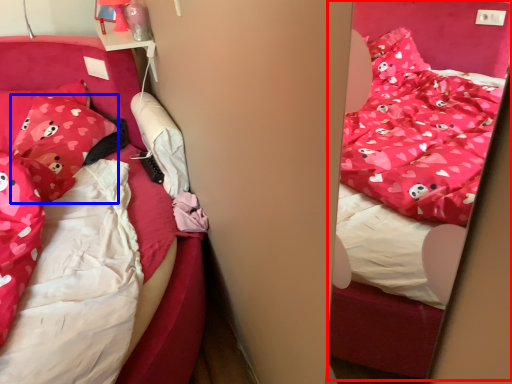
Question: Which object is further to the camera taking this photo, bed (highlighted by a red box) or pillow (highlighted by a blue box)?

Choices:
 (A) bed
 (B) pillow

Answer: (B)